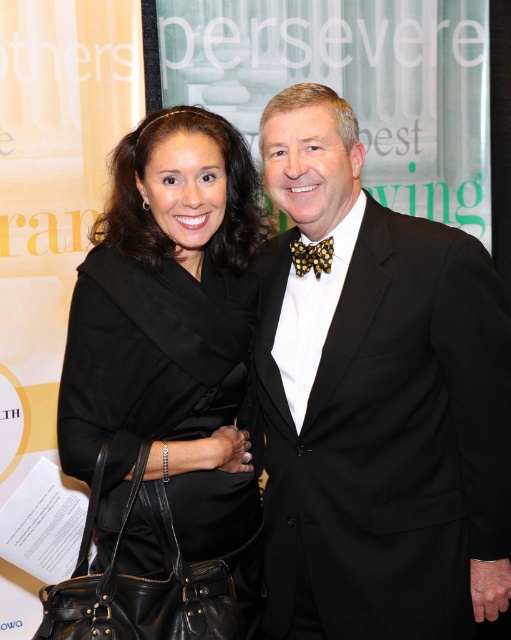
How far apart are black satin suit at center and yellow dotted bow tie at center?

black satin suit at center is 14.25 inches from yellow dotted bow tie at center.

Which is behind, point (331, 531) or point (324, 259)?

Point (324, 259)

You are a GUI agent. You are given a task and a screenshot of the screen. Output one action in this format:
    pyautogui.click(x=<x>, y=<y>)
    Task: Click on the black satin suit at center
    The image size is (511, 640).
    Given the screenshot: What is the action you would take?
    pyautogui.click(x=377, y=403)

In order to click on black satin suit at center in this screenshot , I will do `click(377, 403)`.

Is black satin suit at center smaller than black leather handbag at lower left?

No.

Between point (323, 552) and point (166, 125), which one is positioned in front?

Positioned in front is point (323, 552).

Identify the location of black satin suit at center. (377, 403).

At what (x,y) coordinates should I click in order to perform the action: click on black satin suit at center. Please return your answer as a coordinate pair (x, y). Looking at the image, I should click on (377, 403).

Does black leather handbag at lower left have a lesser height compared to yellow dotted bow tie at center?

In fact, black leather handbag at lower left may be taller than yellow dotted bow tie at center.

Between point (150, 188) and point (323, 252), which one is positioned behind?

Point (323, 252)

Identify the location of black leather handbag at lower left. 171,349.